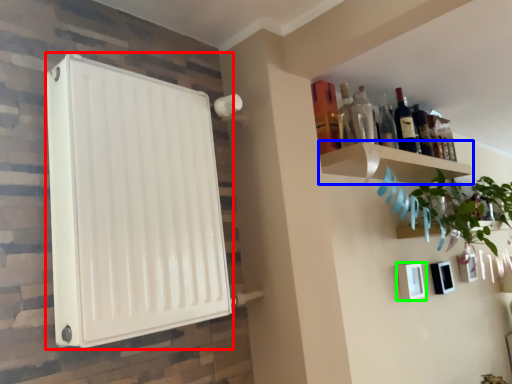
Question: Estimate the real-world distances between objects in this image. Which object is farther from appliance (highlighted by a red box), shelf (highlighted by a blue box) or picture frame (highlighted by a green box)?

Choices:
 (A) shelf
 (B) picture frame

Answer: (B)